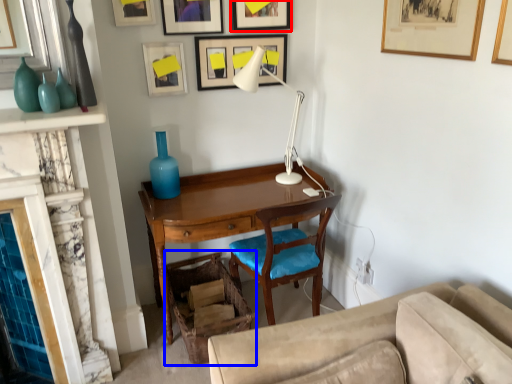
Question: Which object appears farthest to the camera in this image, picture frame (highlighted by a red box) or swivel chair (highlighted by a blue box)?

Choices:
 (A) picture frame
 (B) swivel chair

Answer: (A)